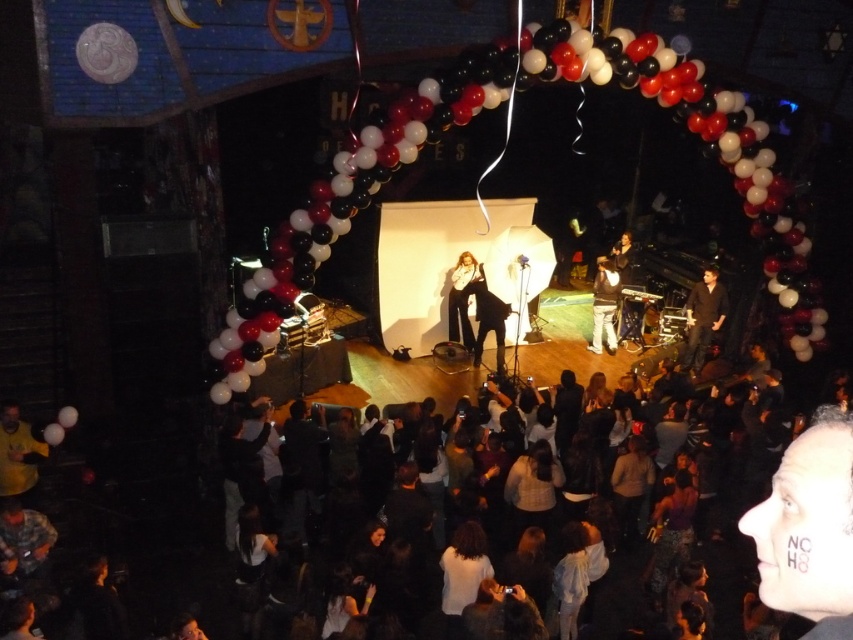
Question: Is white matte face paint at lower right above yellow fabric at lower left?

Choices:
 (A) yes
 (B) no

Answer: (A)

Question: Does black leather pants at center have a greater width compared to white leather jacket at center?

Choices:
 (A) yes
 (B) no

Answer: (A)

Question: Which object appears farthest from the camera in this image?

Choices:
 (A) red and white balloons at center
 (B) white leather jacket at center
 (C) dark brown leather jacket at right

Answer: (B)

Question: Which is nearer to the dark brown leather jacket at right?

Choices:
 (A) black leather pants at center
 (B) red and white balloons at center

Answer: (B)

Question: Does red and white balloons at center appear on the right side of yellow fabric at lower left?

Choices:
 (A) no
 (B) yes

Answer: (B)

Question: Which of the following is the farthest from the observer?

Choices:
 (A) dark brown leather jacket at right
 (B) dark clothing crowd at center

Answer: (A)